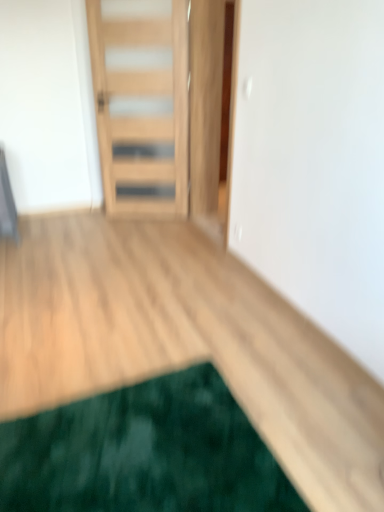
Where is `vacant space in green plush mat at lower left (from a real-world perspective)`? This screenshot has width=384, height=512. vacant space in green plush mat at lower left (from a real-world perspective) is located at coordinates (146, 445).